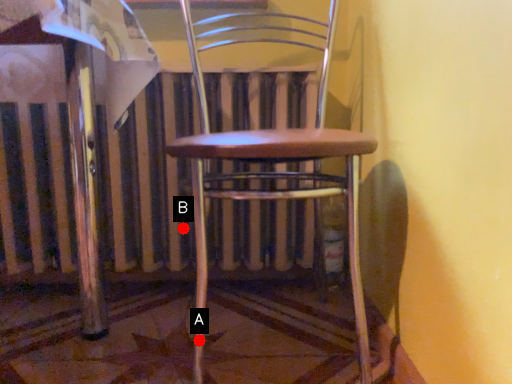
Question: Two points are circled on the image, labeled by A and B beside each circle. Which point is closer to the camera?

Choices:
 (A) A is closer
 (B) B is closer

Answer: (A)